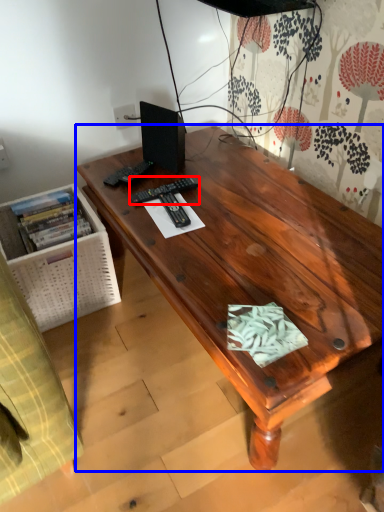
Question: Which point is further to the camera, remote control (highlighted by a red box) or desk (highlighted by a blue box)?

Choices:
 (A) remote control
 (B) desk

Answer: (A)